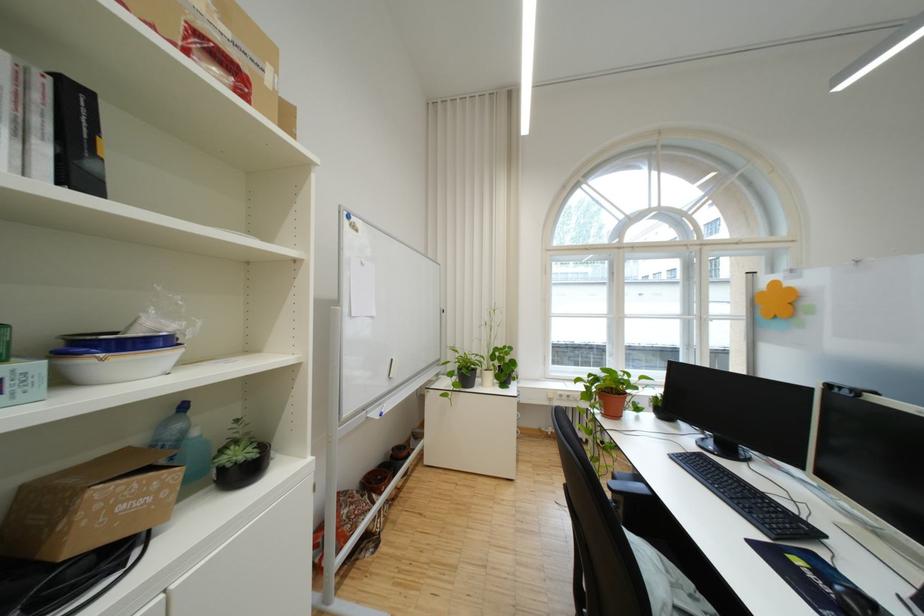
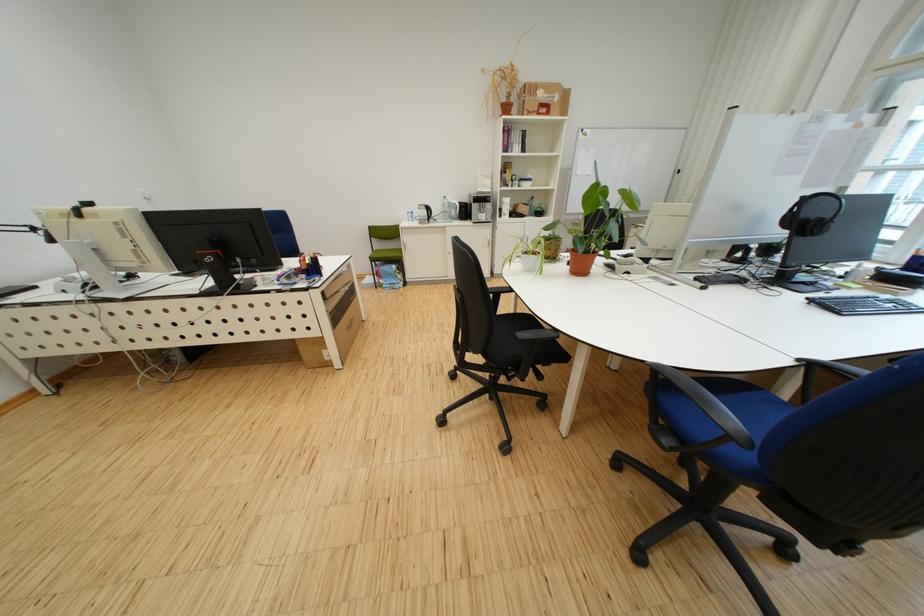
Question: I am providing you with two images of the same scene from different viewpoints. After the viewpoint changes to image2, which objects are now occluded?

Choices:
 (A) terracotta plant pot
 (B) potted plant
 (C) black computer mouse
 (D) wooden trash can lid

Answer: (B)